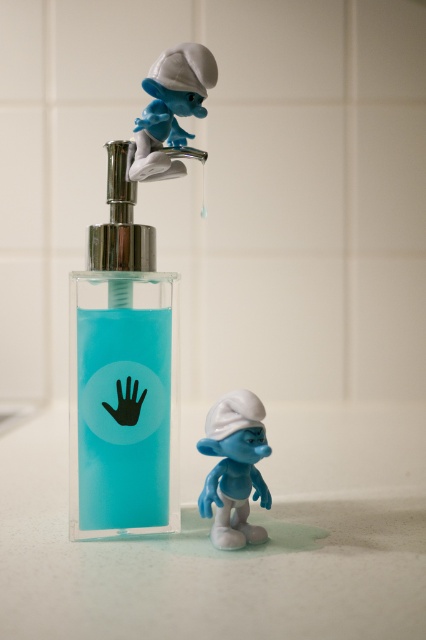
You are organizing a bathroom shelf and need to place the transparent plastic soap dispenser at center and the blue matte smurf at lower center. According to the scene, which object is positioned higher?

The transparent plastic soap dispenser at center is positioned higher than the blue matte smurf at lower center because it is located above it.

You are a visitor in this bathroom and want to take a photo of both blue matte smurf at lower center and blue matte smurf at upper center without any obstruction. Which smurf should you position closer to the camera to ensure both are fully visible?

You should position the blue matte smurf at lower center closer to the camera because it is in front of the blue matte smurf at upper center, so moving it forward will prevent it from blocking the view of the one behind.

You are standing in front of the bathroom countertop and see the point marked at coordinates (x=121, y=371). Where is this point located?

The point marked at coordinates (x=121, y=371) is located on the transparent plastic soap dispenser at center.